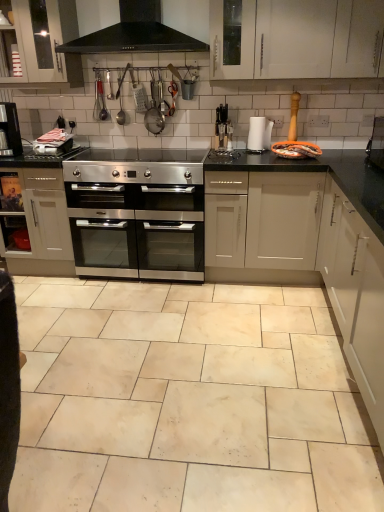
Locate an element on the screen. The width and height of the screenshot is (384, 512). free location to the left of black granite countertop at center is located at coordinates (172, 309).